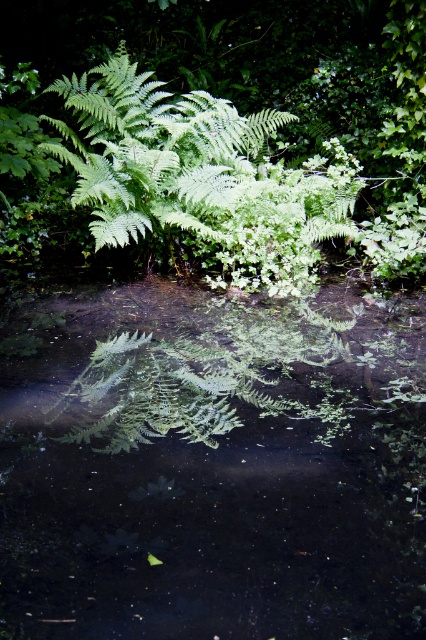
This screenshot has height=640, width=426. What do you see at coordinates (212, 465) in the screenshot? I see `green leafy water at center` at bounding box center [212, 465].

Find the location of a particular element. This screenshot has width=426, height=640. green leafy water at center is located at coordinates (212, 465).